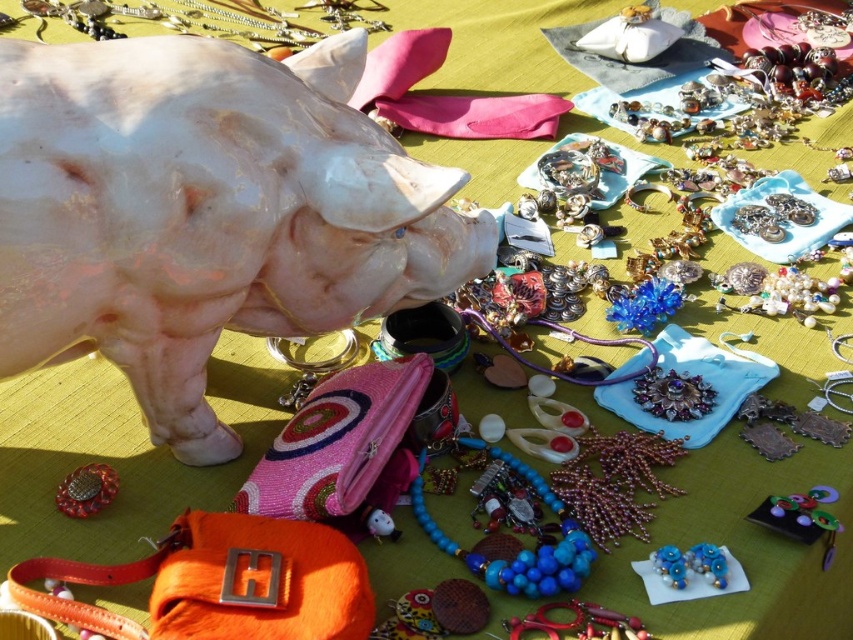
What do you see at coordinates (206, 212) in the screenshot? This screenshot has height=640, width=853. I see `white glossy pig at upper left` at bounding box center [206, 212].

Who is taller, white glossy pig at upper left or blue beaded earrings at lower right?

Standing taller between the two is white glossy pig at upper left.

Describe the element at coordinates (206, 212) in the screenshot. The image size is (853, 640). I see `white glossy pig at upper left` at that location.

This screenshot has height=640, width=853. In order to click on white glossy pig at upper left in this screenshot , I will do `click(206, 212)`.

Who is lower down, blue beaded necklace at center or blue beaded earrings at lower right?

blue beaded earrings at lower right is below.

Is point (561, 508) closer to camera compared to point (670, 566)?

No, it is not.

In order to click on blue beaded necklace at center in this screenshot , I will do `click(517, 554)`.

Does point (167, 150) come farther from viewer compared to point (579, 538)?

No, (167, 150) is in front of (579, 538).

Between white glossy pig at upper left and blue beaded necklace at center, which one is positioned lower?

blue beaded necklace at center

Does point (294, 152) come closer to viewer compared to point (576, 538)?

That is True.

Locate an element on the screen. Image resolution: width=853 pixels, height=640 pixels. white glossy pig at upper left is located at coordinates (206, 212).